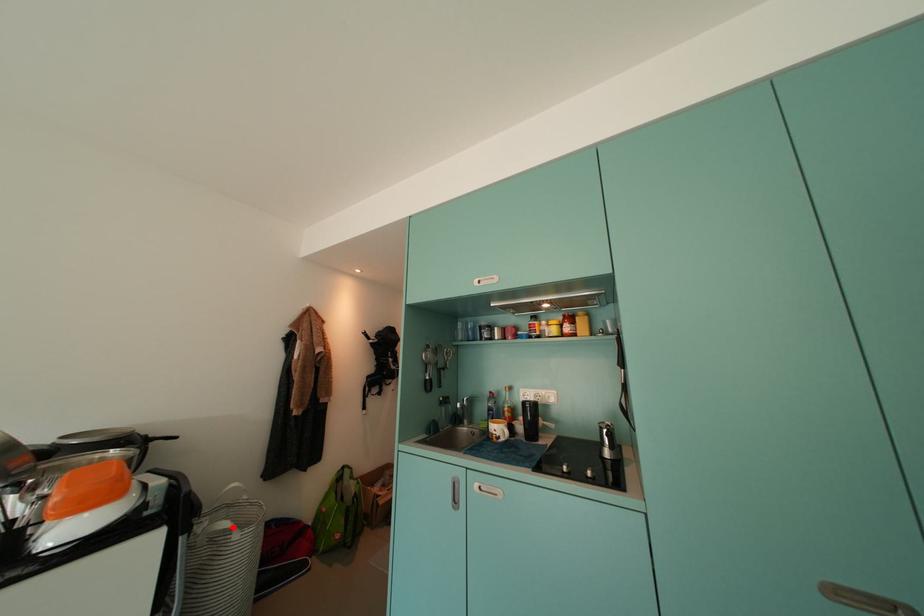
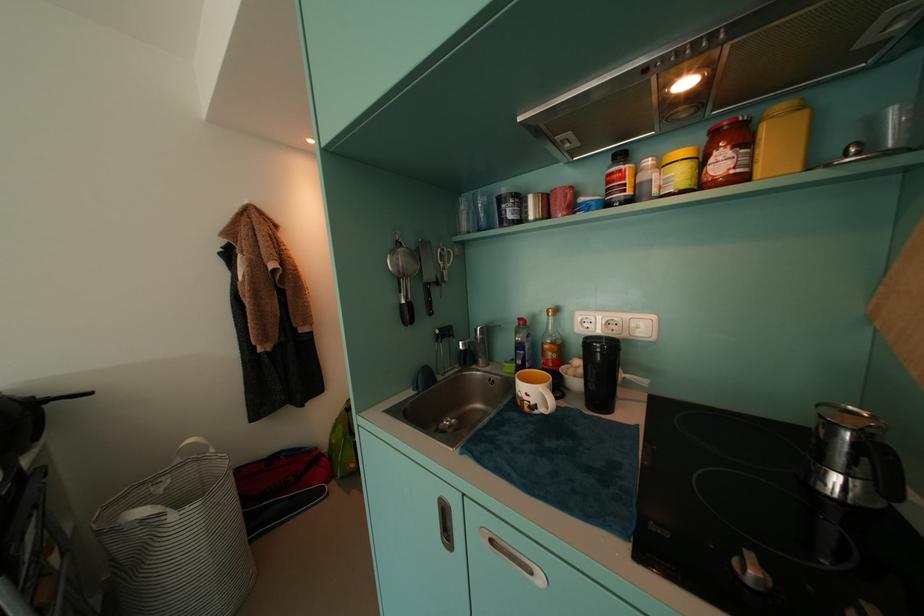
Find the pixel in the second image that matches the highlighted location in the first image.

(149, 516)